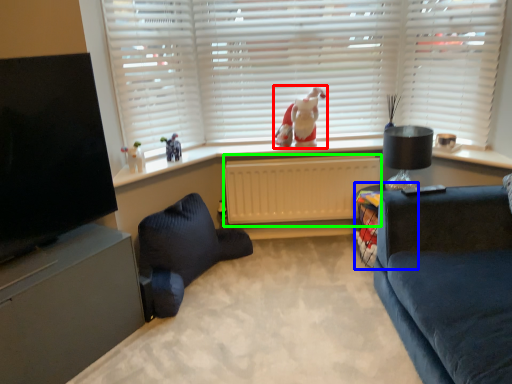
Question: Which object is the farthest from toy (highlighted by a red box)? Choose among these: table (highlighted by a blue box) or radiator (highlighted by a green box).

Choices:
 (A) table
 (B) radiator

Answer: (A)